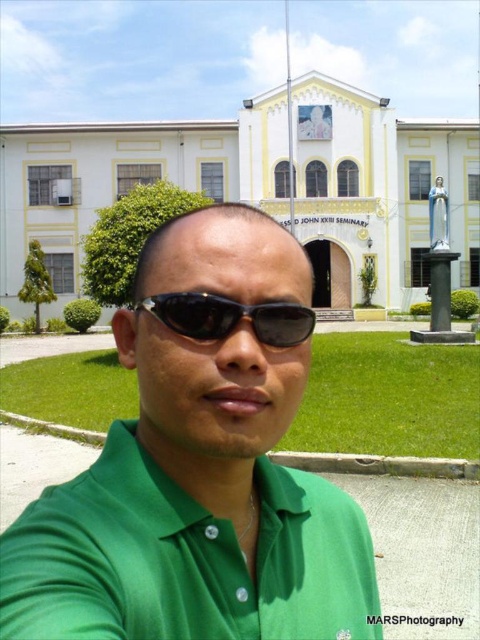
Based on the photo, who is lower down, green matte shirt at center or black reflective sunglasses at center?

green matte shirt at center is lower down.

Is green matte shirt at center shorter than black reflective sunglasses at center?

No, green matte shirt at center is not shorter than black reflective sunglasses at center.

This screenshot has height=640, width=480. What do you see at coordinates (200, 467) in the screenshot?
I see `green matte shirt at center` at bounding box center [200, 467].

This screenshot has height=640, width=480. Identify the location of green matte shirt at center. (200, 467).

Who is more distant from viewer, [336,515] or [332,484]?

Point [332,484]

Does green matte shirt at center have a lesser height compared to green satin dress shirt at center?

No, green matte shirt at center is not shorter than green satin dress shirt at center.

What do you see at coordinates (200, 467) in the screenshot? The height and width of the screenshot is (640, 480). I see `green matte shirt at center` at bounding box center [200, 467].

The width and height of the screenshot is (480, 640). What are the coordinates of `green matte shirt at center` in the screenshot? It's located at (200, 467).

Is green satin dress shirt at center bigger than black reflective sunglasses at center?

Yes.

Which is in front, point (94, 614) or point (144, 308)?

Point (94, 614) is in front.

You are a GUI agent. You are given a task and a screenshot of the screen. Output one action in this format:
    pyautogui.click(x=<x>, y=<y>)
    Task: Click on the green satin dress shirt at center
    The height and width of the screenshot is (640, 480).
    Given the screenshot: What is the action you would take?
    184,557